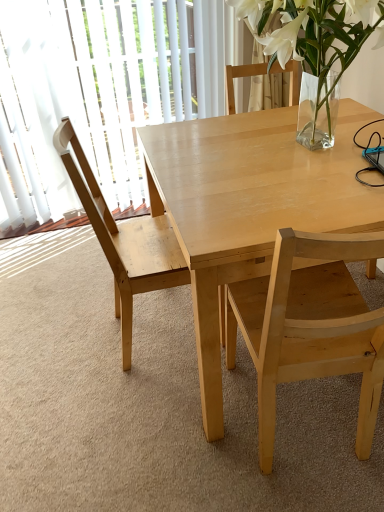
This screenshot has height=512, width=384. Find the location of `free space to the left of light wood table at center`. free space to the left of light wood table at center is located at coordinates (76, 353).